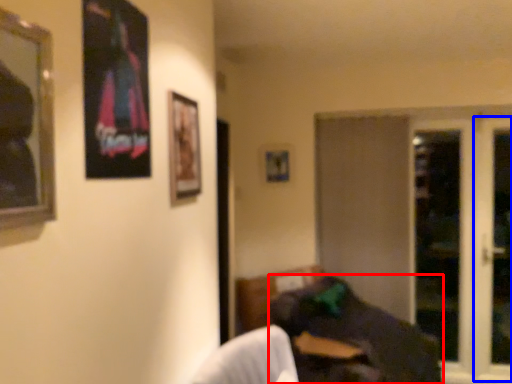
Question: Which object appears farthest to the camera in this image, bean bag chair (highlighted by a red box) or screen door (highlighted by a blue box)?

Choices:
 (A) bean bag chair
 (B) screen door

Answer: (B)